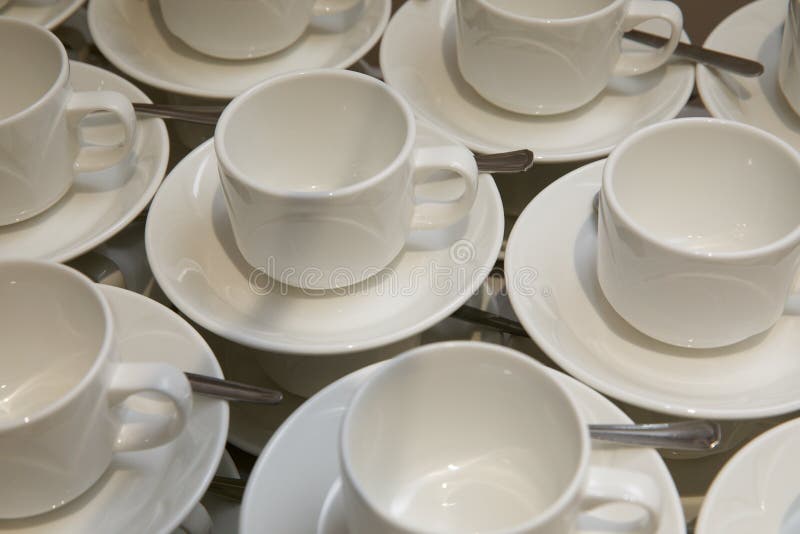
At what (x,y) coordinates should I click in order to perform the action: click on mug handles. Please return your answer as a coordinate pair (x, y). This screenshot has width=800, height=534. Looking at the image, I should click on (148, 378), (86, 104), (108, 271), (200, 519), (338, 17), (444, 159), (666, 12), (792, 305), (614, 485).